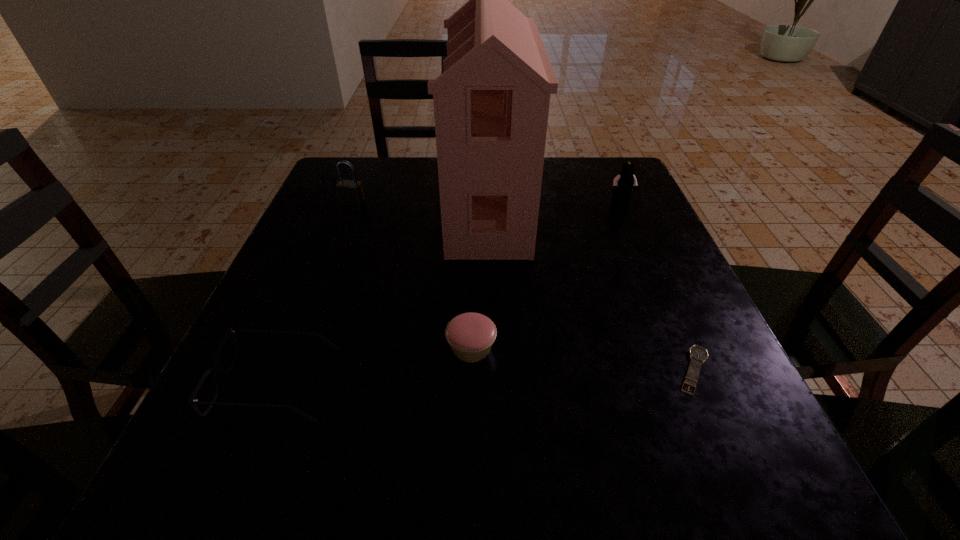
This screenshot has height=540, width=960. Identify the location of free spot that satisfies the following two spatial constraints: 1. on the front-facing side of the Lego; 2. on the front-facing side of the dollhouse. (622, 204).

The image size is (960, 540). I want to click on vacant region that satisfies the following two spatial constraints: 1. on the front-facing side of the watch; 2. on the left side of the dollhouse, so (492, 370).